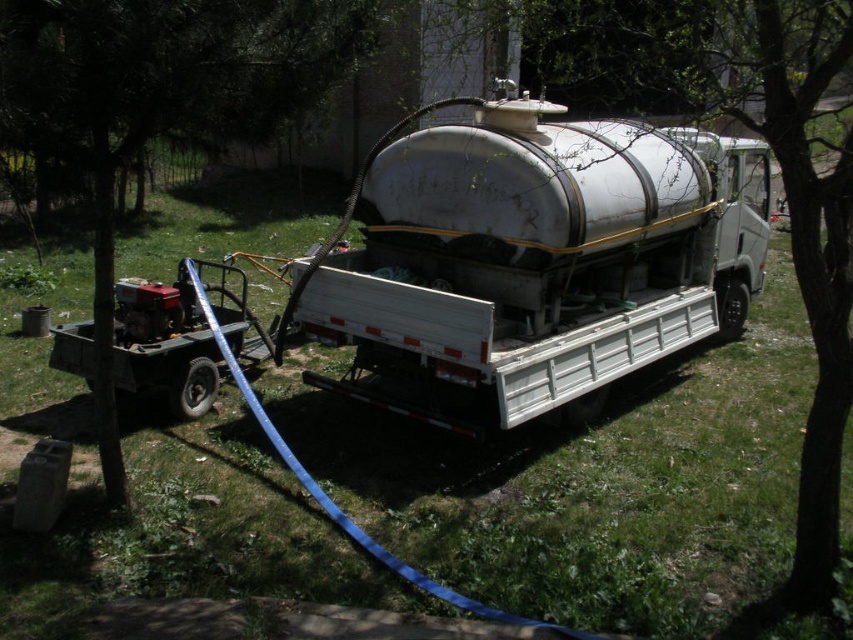
Is the position of green leafy tree at upper right less distant than that of green leafy tree at upper left?

Yes, it is.

Between point (759, 70) and point (160, 132), which one is positioned in front?

Point (759, 70) is in front.

Locate an element on the screen. Image resolution: width=853 pixels, height=640 pixels. green leafy tree at upper right is located at coordinates (772, 152).

The image size is (853, 640). What do you see at coordinates (595, 486) in the screenshot?
I see `green grass at center` at bounding box center [595, 486].

What are the coordinates of `green grass at center` in the screenshot? It's located at (595, 486).

Does green grass at center have a lesser width compared to white matte tanker truck at center?

No, green grass at center is not thinner than white matte tanker truck at center.

Does green grass at center appear on the right side of white matte tanker truck at center?

In fact, green grass at center is to the left of white matte tanker truck at center.

Image resolution: width=853 pixels, height=640 pixels. What are the coordinates of `green grass at center` in the screenshot? It's located at (595, 486).